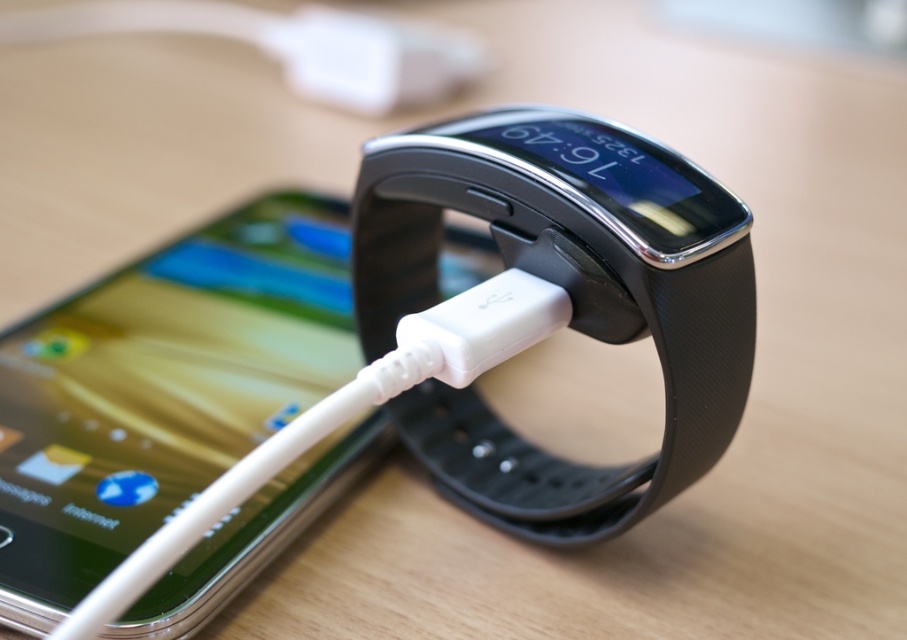
Who is positioned more to the left, black rubber watch at center or white plastic usb cable at center?

white plastic usb cable at center is more to the left.

Does black rubber watch at center come in front of white plastic usb cable at center?

No, it is behind white plastic usb cable at center.

The width and height of the screenshot is (907, 640). What are the coordinates of `black rubber watch at center` in the screenshot? It's located at (567, 301).